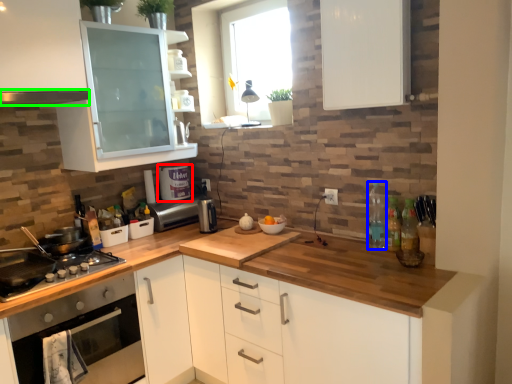
Question: Which object is positioned closest to appliance (highlighted by a red box)? Select from bottle (highlighted by a blue box) and exhaust hood (highlighted by a green box).

Choices:
 (A) bottle
 (B) exhaust hood

Answer: (B)